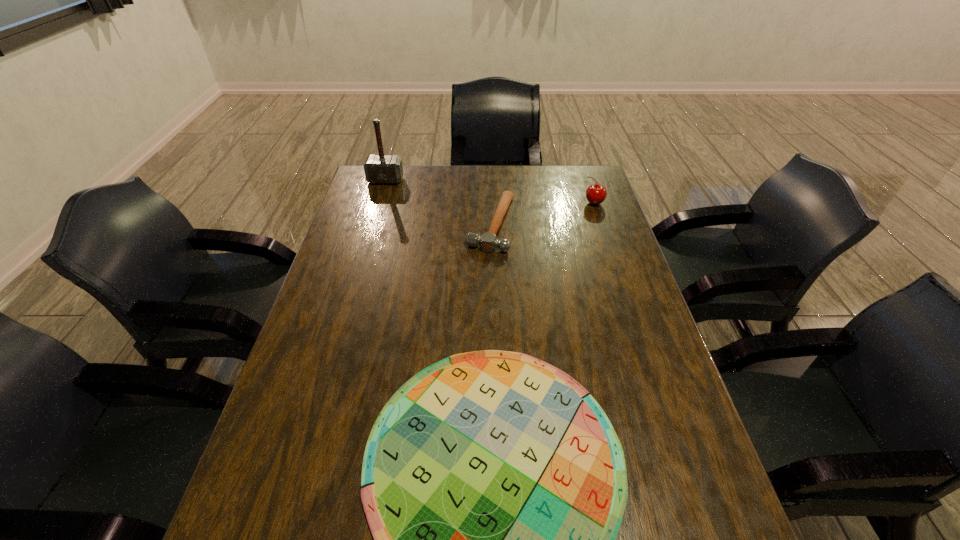
This screenshot has width=960, height=540. What are the coordinates of `free space between the farthest object and the cherry` in the screenshot? It's located at (490, 192).

Find the location of a particular element. The image size is (960, 540). vacant region between the farther hammer and the second shortest object is located at coordinates (439, 202).

This screenshot has height=540, width=960. Find the location of `object that ranks as the closest to the nearer hammer`. object that ranks as the closest to the nearer hammer is located at coordinates (595, 193).

Identify which object is the nearest to the rightmost object. Please provide its 2D coordinates. Your answer should be formatted as a tuple, i.e. [(x, y)], where the tuple contains the x and y coordinates of a point satisfying the conditions above.

[(488, 242)]

Where is `free point that satisfies the following two spatial constraints: 1. on the front side of the farther hammer; 2. on the left side of the cherry`? This screenshot has width=960, height=540. free point that satisfies the following two spatial constraints: 1. on the front side of the farther hammer; 2. on the left side of the cherry is located at coordinates (379, 203).

This screenshot has width=960, height=540. In order to click on free space that satisfies the following two spatial constraints: 1. on the back side of the third tallest object; 2. on the right side of the cherry in this screenshot , I will do `click(491, 203)`.